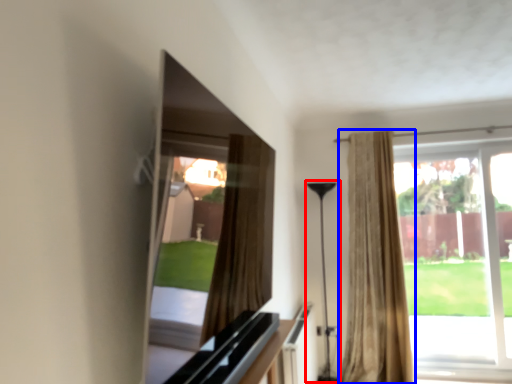
Question: Among these objects, which one is nearest to the camera, lamp (highlighted by a red box) or curtain (highlighted by a blue box)?

Choices:
 (A) lamp
 (B) curtain

Answer: (B)